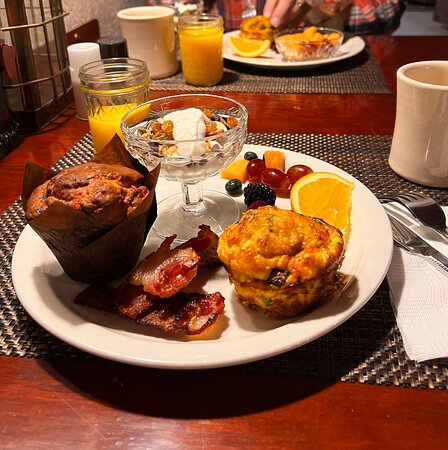
Image resolution: width=448 pixels, height=450 pixels. Identify the location of white mug. (429, 121).